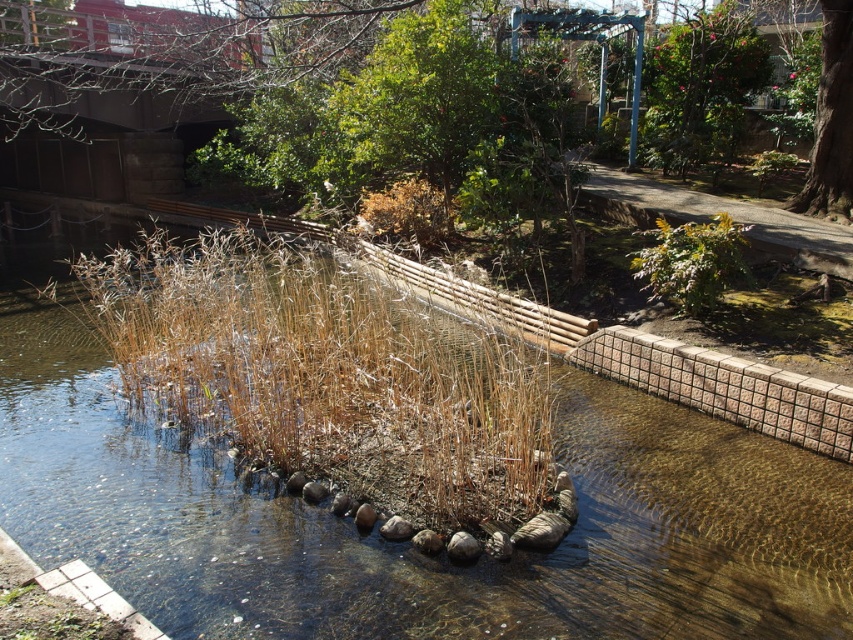
Question: Based on their relative distances, which object is farther from the green leafy tree at upper right?

Choices:
 (A) brown grassy stream at center
 (B) green leafy plant at center-right
 (C) dry grass at center

Answer: (C)

Question: From the image, what is the correct spatial relationship of brown grassy stream at center in relation to dry grass at center?

Choices:
 (A) right
 (B) left

Answer: (A)

Question: Is dry grass at center above green leafy tree at upper right?

Choices:
 (A) no
 (B) yes

Answer: (A)

Question: Among these points, which one is farthest from the camera?

Choices:
 (A) (361, 484)
 (B) (846, 160)

Answer: (B)

Question: Which point is farther to the camera?

Choices:
 (A) dry grass at center
 (B) brown grassy stream at center
 (C) green leafy plant at center-right
 (D) green leafy tree at upper right

Answer: (D)

Question: Does brown grassy stream at center have a larger size compared to green leafy plant at center-right?

Choices:
 (A) yes
 (B) no

Answer: (A)